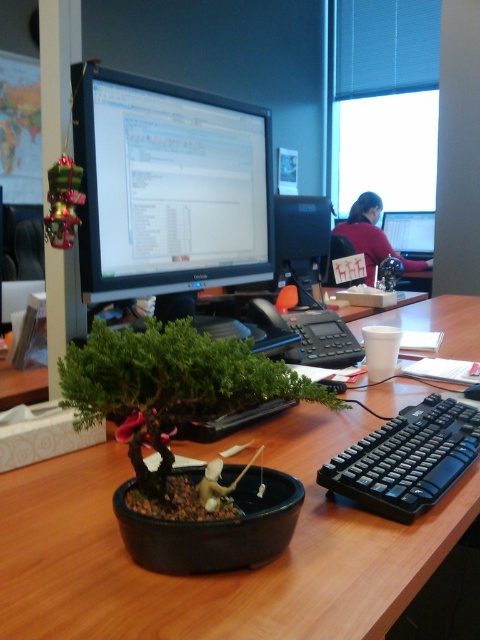
Based on the photo, can you confirm if matte black monitor at center is smaller than green matte bonsai tree at lower left?

Incorrect, matte black monitor at center is not smaller in size than green matte bonsai tree at lower left.

Is matte black monitor at center shorter than green matte bonsai tree at lower left?

In fact, matte black monitor at center may be taller than green matte bonsai tree at lower left.

Find the location of `matte black monitor at center`. matte black monitor at center is located at coordinates (168, 188).

Consider the image. Can you confirm if matte black monitor at center is positioned above black plastic keyboard at right?

Yes.

Is matte black monitor at center to the right of black plastic keyboard at right from the viewer's perspective?

No, matte black monitor at center is not to the right of black plastic keyboard at right.

Measure the distance between matte black monitor at center and camera.

91.64 centimeters

Where is `matte black monitor at center`? This screenshot has width=480, height=640. matte black monitor at center is located at coordinates (168, 188).

Does green matte bonsai tree at lower left appear under matte black monitor at upper center?

Correct, green matte bonsai tree at lower left is located below matte black monitor at upper center.

Who is more forward, (115,378) or (420,250)?

Point (115,378) is more forward.

Is point (94, 362) positioned behind point (432, 241)?

No, it is not.

Identify the location of green matte bonsai tree at lower left. (170, 384).